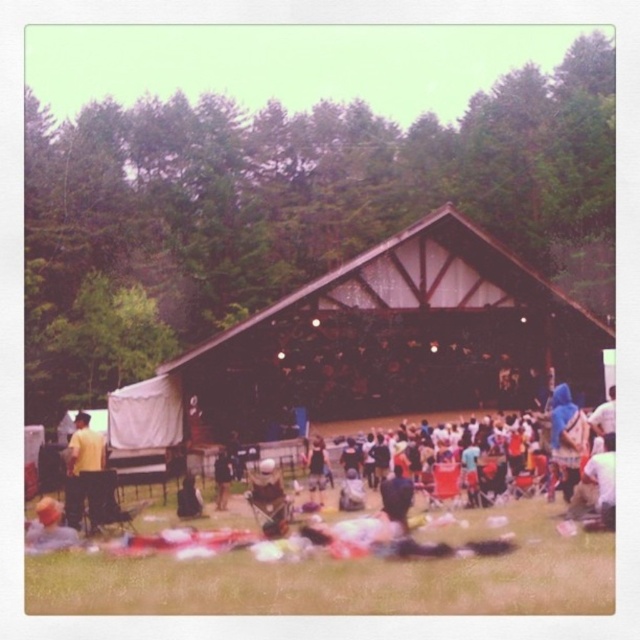
Question: Which object appears farthest from the camera in this image?

Choices:
 (A) brown wooden barn at center
 (B) blue fabric at right
 (C) blonde hair at lower left

Answer: (A)

Question: Can you confirm if brown wooden barn at center is positioned to the left of blonde hair at lower left?

Choices:
 (A) yes
 (B) no

Answer: (B)

Question: Can you confirm if yellow fabric at left is thinner than blue fabric at right?

Choices:
 (A) yes
 (B) no

Answer: (A)

Question: Which point is closer to the camera taking this photo?

Choices:
 (A) (225, 502)
 (B) (54, 540)

Answer: (B)

Question: Which point is closer to the camera?

Choices:
 (A) (218, 458)
 (B) (97, 497)
 (C) (38, 518)
 (D) (609, 419)

Answer: (C)

Question: Is brown wooden barn at center smaller than blue fabric at right?

Choices:
 (A) yes
 (B) no

Answer: (B)